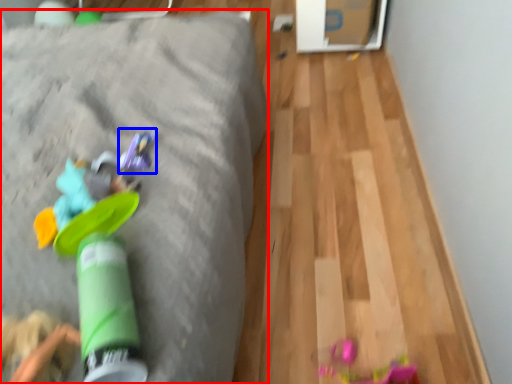
Question: Which object is further to the camera taking this photo, furniture (highlighted by a red box) or toy (highlighted by a blue box)?

Choices:
 (A) furniture
 (B) toy

Answer: (A)